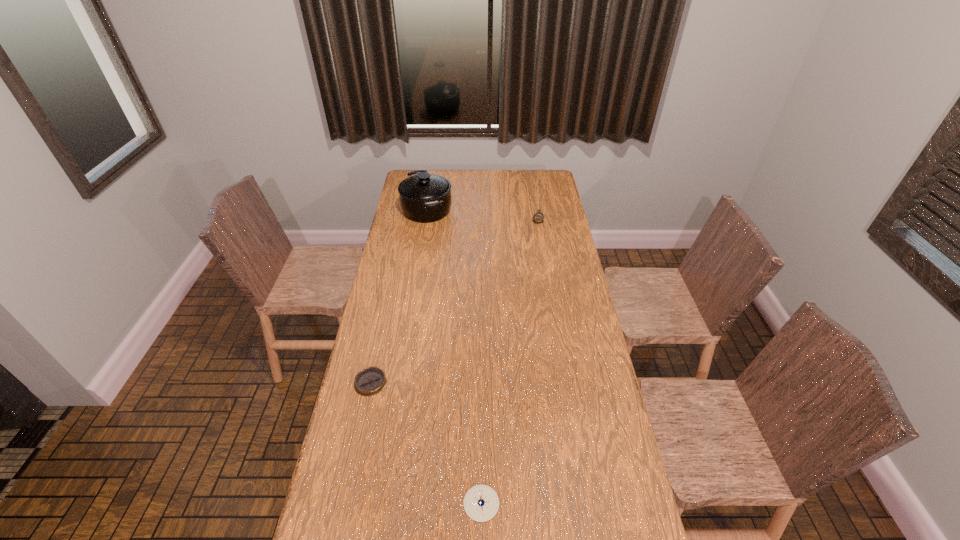
At what (x,y) coordinates should I click in order to perform the action: click on vacant space in between the nearest compass and the tallest object. Please return your answer as a coordinate pair (x, y). Looking at the image, I should click on (454, 356).

Find the location of a particular element. The image size is (960, 540). unoccupied area between the tallest compass and the saucepan is located at coordinates (482, 215).

Locate an element on the screen. vacant area between the leftmost compass and the second object from right to left is located at coordinates (426, 443).

This screenshot has width=960, height=540. Find the location of `blank region between the rightmost object and the tallest object`. blank region between the rightmost object and the tallest object is located at coordinates (482, 215).

Locate an element on the screen. Image resolution: width=960 pixels, height=540 pixels. free spot between the nearest compass and the tallest object is located at coordinates (454, 356).

At what (x,y) coordinates should I click in order to perform the action: click on empty space that is in between the tallest compass and the shortest compass. Please return your answer as a coordinate pair (x, y). The height and width of the screenshot is (540, 960). Looking at the image, I should click on (454, 301).

Locate an element on the screen. This screenshot has height=540, width=960. free space between the nearest object and the saucepan is located at coordinates (454, 356).

Locate an element on the screen. The width and height of the screenshot is (960, 540). empty location between the second compass from right to left and the shortest compass is located at coordinates (426, 443).

Locate an element on the screen. The height and width of the screenshot is (540, 960). object identified as the third closest to the shortest compass is located at coordinates (538, 217).

Locate which object ranks in proximity to the second shortest compass. Please provide its 2D coordinates. Your answer should be formatted as a tuple, i.e. [(x, y)], where the tuple contains the x and y coordinates of a point satisfying the conditions above.

[(370, 381)]